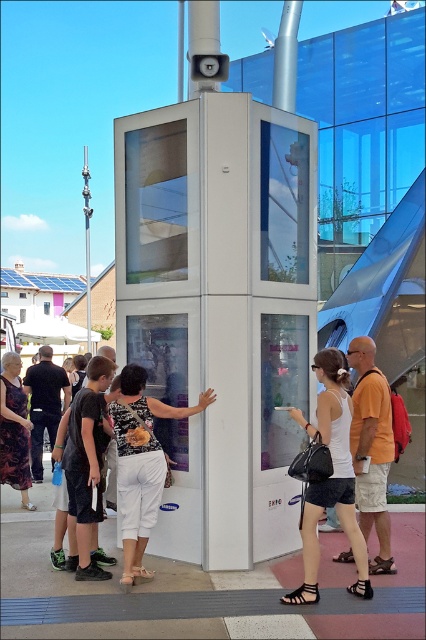
Question: Does white glossy phone box at center appear under white fabric tank top at center?

Choices:
 (A) yes
 (B) no

Answer: (B)

Question: Which object is positioned farthest from the printed fabric blouse at center?

Choices:
 (A) white glossy phone box at center
 (B) dark gray t-shirt at center

Answer: (A)

Question: Can you confirm if white glossy phone box at center is smaller than dark gray t-shirt at center?

Choices:
 (A) yes
 (B) no

Answer: (B)

Question: Can you confirm if white glossy phone box at center is positioned to the left of printed fabric blouse at center?

Choices:
 (A) yes
 (B) no

Answer: (B)

Question: Which of the following is the closest to the observer?

Choices:
 (A) (250, 221)
 (B) (80, 568)
 (C) (310, 518)
 (D) (135, 529)

Answer: (C)

Question: Which point is farther to the camera?

Choices:
 (A) white fabric tank top at center
 (B) white glossy phone box at center
 (C) orange cotton t-shirt at center-right

Answer: (B)